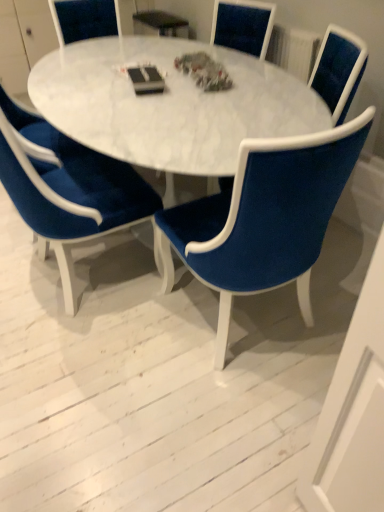
The image size is (384, 512). Find the location of `vacant space to the left of velvet blue chair at center, the 2th chair from the right`. vacant space to the left of velvet blue chair at center, the 2th chair from the right is located at coordinates (112, 350).